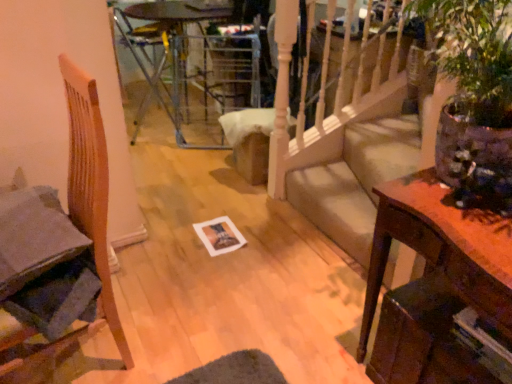
Image resolution: width=512 pixels, height=384 pixels. Find the location of `beige fabric couch at center`. beige fabric couch at center is located at coordinates 355,181.

What do you see at coordinates (484, 343) in the screenshot? The width and height of the screenshot is (512, 384). I see `matte paper magazine at lower right` at bounding box center [484, 343].

What do you see at coordinates (170, 58) in the screenshot? This screenshot has width=512, height=384. I see `transparent glass table at center` at bounding box center [170, 58].

The width and height of the screenshot is (512, 384). In order to click on wooden chair at left in this screenshot , I will do pos(58,248).

Between wooden side table at right and transparent glass table at center, which one has less height?

wooden side table at right.

Would you say wooden side table at right is outside transparent glass table at center?

wooden side table at right lies outside transparent glass table at center's area.

From a real-world perspective, who is located lower, wooden side table at right or transparent glass table at center?

wooden side table at right.

Considering the sizes of wooden side table at right and transparent glass table at center in the image, is wooden side table at right bigger or smaller than transparent glass table at center?

In the image, wooden side table at right appears to be smaller than transparent glass table at center.

Where is `stairwell located underneath the wooden chair at left (from a real-world perspective)`? stairwell located underneath the wooden chair at left (from a real-world perspective) is located at coordinates (355, 181).

From the image's perspective, who appears lower, beige fabric couch at center or wooden chair at left?

From the image's view, wooden chair at left is below.

Which object is thinner, beige fabric couch at center or wooden chair at left?

wooden chair at left is thinner.

Measure the distance from beige fabric couch at center to wooden chair at left.

They are 4.37 feet apart.

From the picture: Is metallic silver armchair at upper center not close to wooden side table at right?

Yes, metallic silver armchair at upper center and wooden side table at right are quite far apart.

Measure the distance from metallic silver armchair at upper center to wooden side table at right.

metallic silver armchair at upper center is 2.41 meters from wooden side table at right.

Is metallic silver armchair at upper center in front of or behind wooden side table at right in the image?

Clearly, metallic silver armchair at upper center is behind wooden side table at right.

Considering the sizes of objects metallic silver armchair at upper center and wooden side table at right in the image provided, who is taller, metallic silver armchair at upper center or wooden side table at right?

With more height is metallic silver armchair at upper center.

From a real-world perspective, is matte paper magazine at lower right positioned over wooden side table at right based on gravity?

Yes, from a real-world perspective, matte paper magazine at lower right is over wooden side table at right

Can you confirm if matte paper magazine at lower right is thinner than wooden side table at right?

Yes, matte paper magazine at lower right is thinner than wooden side table at right.

Is matte paper magazine at lower right beside wooden side table at right?

No, matte paper magazine at lower right is not with wooden side table at right.

You are a GUI agent. You are given a task and a screenshot of the screen. Output one action in this format:
    pyautogui.click(x=<x>, y=<y>)
    Task: Click on the table beneath the matte paper magazine at lower right (from a real-world perspective)
    
    Given the screenshot: What is the action you would take?
    pyautogui.click(x=435, y=285)

The image size is (512, 384). In the image, there is a wooden side table at right. Find the location of `chair above it (from the image's perspective)`. chair above it (from the image's perspective) is located at coordinates (58, 248).

From the picture: How different are the orientations of wooden chair at left and wooden side table at right in degrees?

4.49 degrees separate the facing orientations of wooden chair at left and wooden side table at right.

Is wooden chair at left bigger than wooden side table at right?

Yes, wooden chair at left is bigger than wooden side table at right.

Can you see beige fabric couch at center touching transparent glass table at center?

No, beige fabric couch at center is not making contact with transparent glass table at center.

Who is taller, beige fabric couch at center or transparent glass table at center?

transparent glass table at center.

Is beige fabric couch at center aimed at transparent glass table at center?

No, beige fabric couch at center is not aimed at transparent glass table at center.

How many degrees apart are the facing directions of beige fabric couch at center and transparent glass table at center?

The angle between the facing direction of beige fabric couch at center and the facing direction of transparent glass table at center is 1.01 degrees.

Considering the positions of objects metallic silver armchair at upper center and wooden chair at left in the image provided, who is more to the left, metallic silver armchair at upper center or wooden chair at left?

metallic silver armchair at upper center.

Relative to wooden chair at left, is metallic silver armchair at upper center in front or behind?

In the image, metallic silver armchair at upper center appears behind wooden chair at left.

I want to click on glass table that appears above the wooden side table at right (from the image's perspective), so click(170, 58).

Where is `chair that appears below the beige fabric couch at center (from the image's perspective)`? The image size is (512, 384). chair that appears below the beige fabric couch at center (from the image's perspective) is located at coordinates (58, 248).

When comparing their distances from transparent glass table at center, does matte paper magazine at lower right or beige fabric couch at center seem closer?

beige fabric couch at center is positioned closer to the anchor transparent glass table at center.

From the image, which object appears to be farther from transparent glass table at center, wooden side table at right or metallic silver armchair at upper center?

Among the two, wooden side table at right is located further to transparent glass table at center.

Considering their positions, is metallic silver armchair at upper center positioned closer to matte paper magazine at lower right than wooden side table at right?

wooden side table at right is positioned closer to the anchor matte paper magazine at lower right.

Which object lies nearer to the anchor point wooden side table at right, matte paper magazine at lower right or metallic silver armchair at upper center?

Based on the image, matte paper magazine at lower right appears to be nearer to wooden side table at right.

Estimate the real-world distances between objects in this image. Which object is closer to wooden side table at right, transparent glass table at center or beige fabric couch at center?

beige fabric couch at center.

Estimate the real-world distances between objects in this image. Which object is closer to transparent glass table at center, matte paper magazine at lower right or wooden side table at right?

Among the two, wooden side table at right is located nearer to transparent glass table at center.

Estimate the real-world distances between objects in this image. Which object is further from wooden side table at right, transparent glass table at center or matte paper magazine at lower right?

transparent glass table at center.

From the image, which object appears to be nearer to wooden chair at left, matte paper magazine at lower right or transparent glass table at center?

Based on the image, matte paper magazine at lower right appears to be nearer to wooden chair at left.

Locate an element on the screen. magazine between wooden chair at left and transparent glass table at center along the z-axis is located at coordinates (484, 343).

The height and width of the screenshot is (384, 512). Find the location of `stairwell between wooden chair at left and wooden side table at right in the horizontal direction`. stairwell between wooden chair at left and wooden side table at right in the horizontal direction is located at coordinates (355, 181).

The image size is (512, 384). Find the location of `magazine between wooden side table at right and transparent glass table at center in the front-back direction`. magazine between wooden side table at right and transparent glass table at center in the front-back direction is located at coordinates (484, 343).

The height and width of the screenshot is (384, 512). I want to click on table between wooden chair at left and metallic silver armchair at upper center along the z-axis, so click(435, 285).